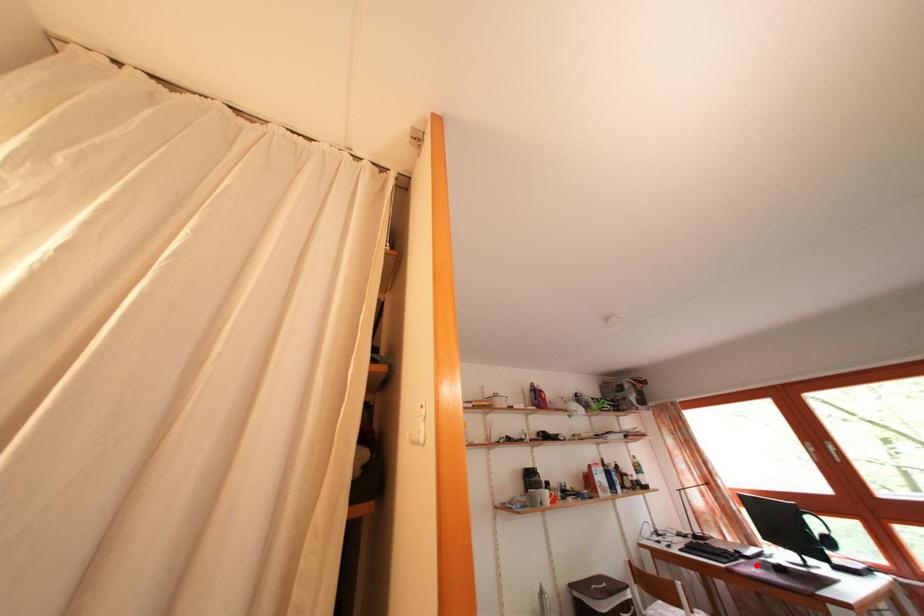
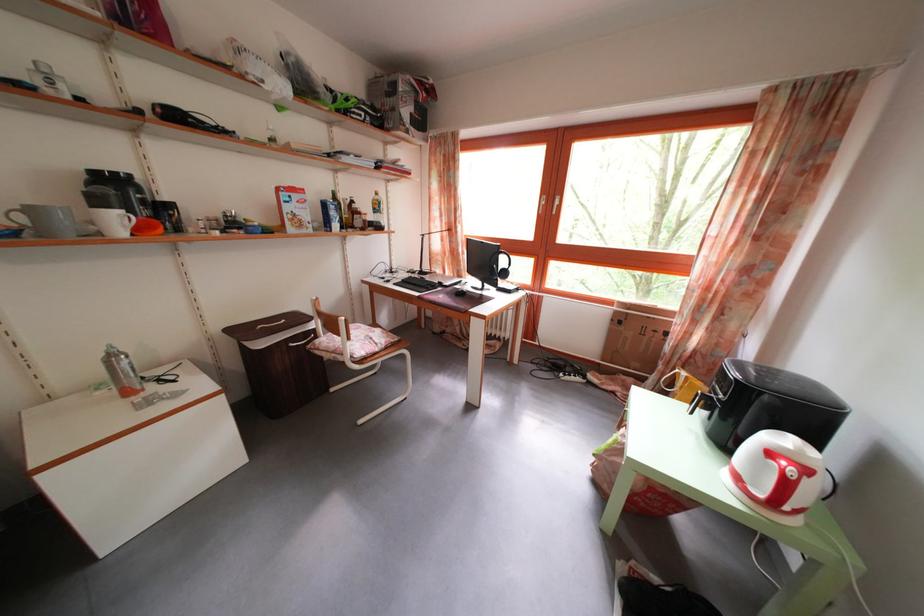
Where in the second image is the point corresponding to the highlighted location from the first image?

(454, 294)